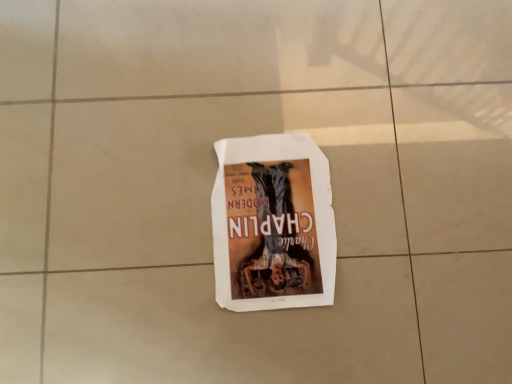
The width and height of the screenshot is (512, 384). Describe the element at coordinates (273, 224) in the screenshot. I see `white paper poster at center` at that location.

Find the location of a particular element. This screenshot has width=512, height=384. white paper poster at center is located at coordinates (273, 224).

The image size is (512, 384). Find the location of `white paper poster at center`. white paper poster at center is located at coordinates (273, 224).